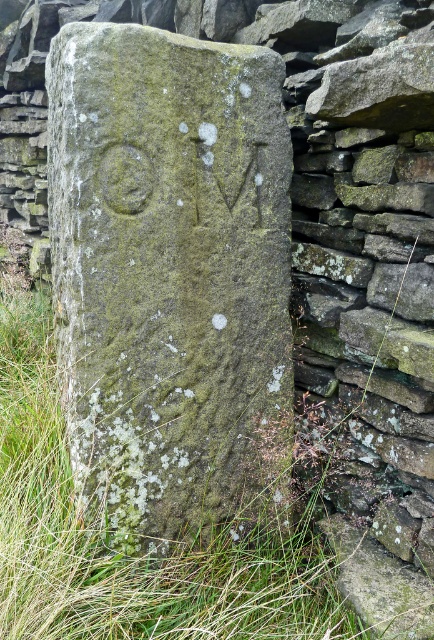
Image resolution: width=434 pixels, height=640 pixels. What do you see at coordinates (170, 275) in the screenshot?
I see `green mossy stone at center` at bounding box center [170, 275].

Does green mossy stone at center have a smaller size compared to green grass at lower left?

Yes.

Which is in front, point (161, 134) or point (255, 582)?

Point (161, 134) is in front.

I want to click on green mossy stone at center, so click(x=170, y=275).